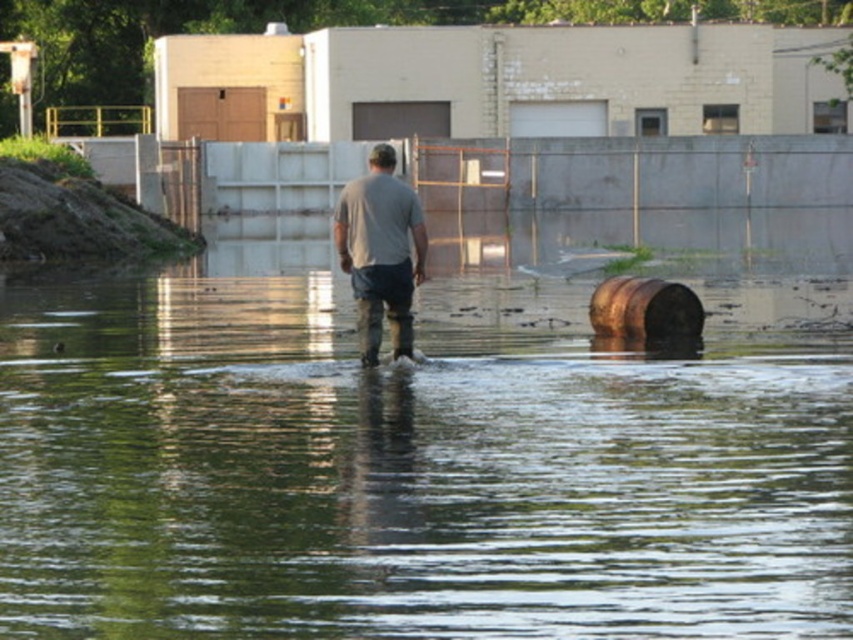
Does clear water at center appear on the right side of gray matte shirt at center?

Correct, you'll find clear water at center to the right of gray matte shirt at center.

Locate an element on the screen. The width and height of the screenshot is (853, 640). clear water at center is located at coordinates (405, 474).